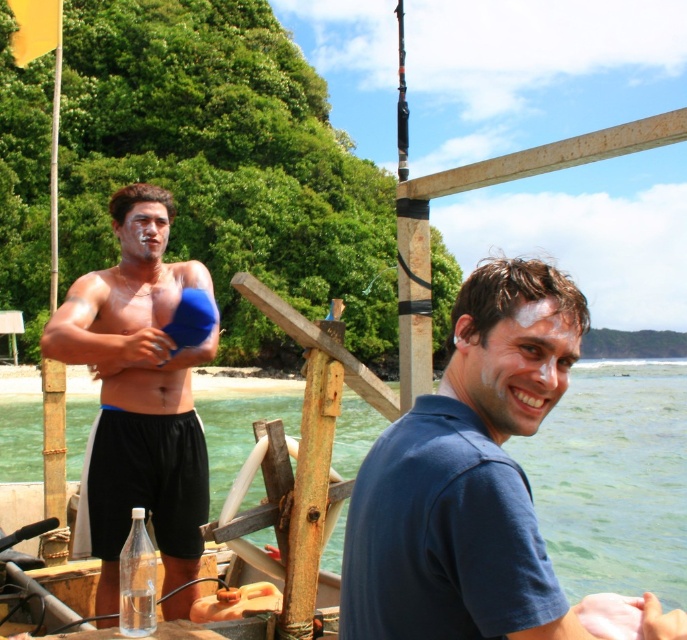
This screenshot has height=640, width=687. What do you see at coordinates (466, 476) in the screenshot? I see `blue cotton shirt at center` at bounding box center [466, 476].

Is blue cotton shirt at center shorter than clear water at boat right?

Indeed, blue cotton shirt at center has a lesser height compared to clear water at boat right.

Where is `blue cotton shirt at center`? blue cotton shirt at center is located at coordinates [x=466, y=476].

Does blue cotton shirt at center have a lesser width compared to clear plastic bottle at center?

No.

Can you confirm if blue cotton shirt at center is shorter than clear plastic bottle at center?

In fact, blue cotton shirt at center may be taller than clear plastic bottle at center.

Which is in front, point (361, 541) or point (150, 589)?

Point (361, 541) is in front.

This screenshot has width=687, height=640. Find the location of `blue cotton shirt at center`. blue cotton shirt at center is located at coordinates (466, 476).

The width and height of the screenshot is (687, 640). What do you see at coordinates (613, 480) in the screenshot?
I see `clear water at boat right` at bounding box center [613, 480].

Where is `clear water at boat right`? clear water at boat right is located at coordinates (613, 480).